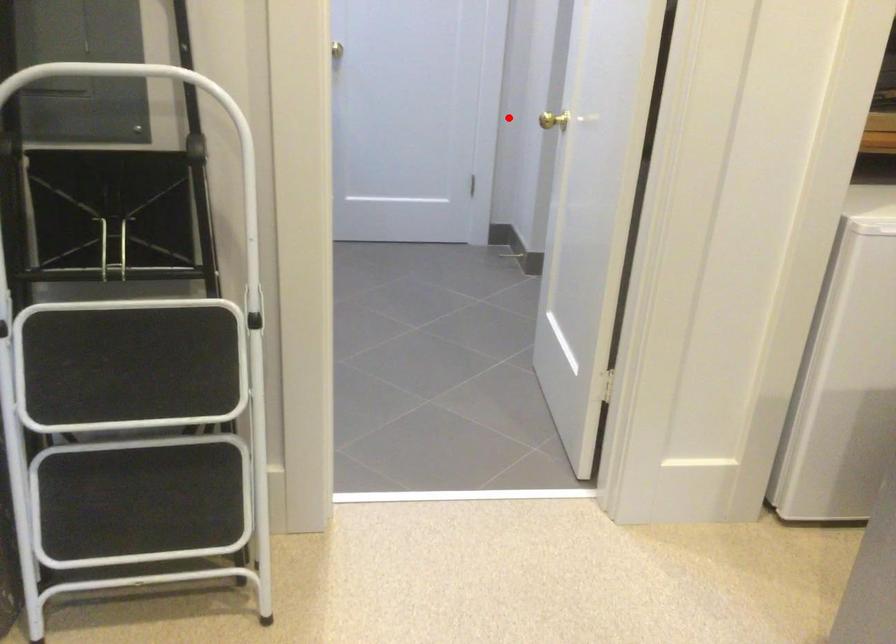
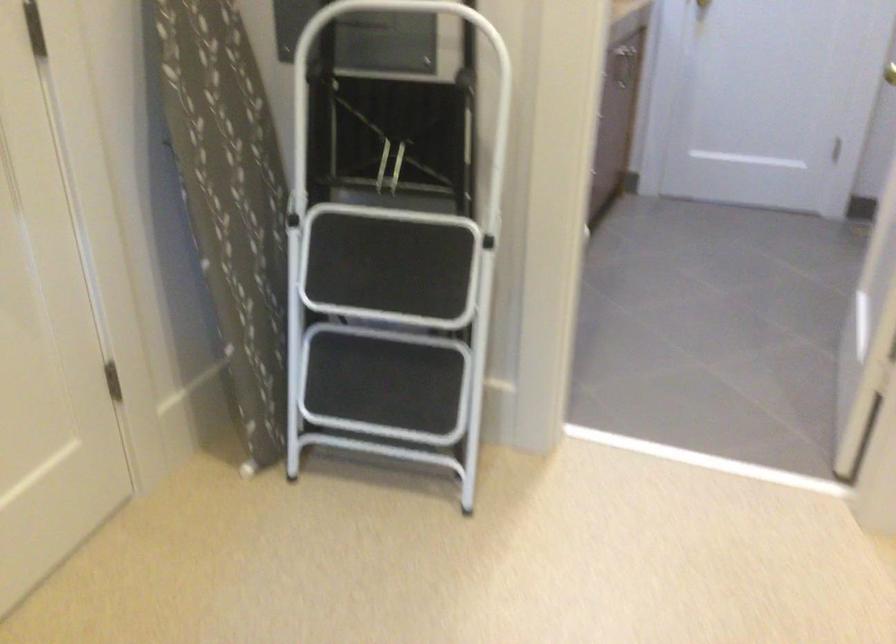
Find the pixel in the second image that matches the highlighted location in the first image.

(890, 73)